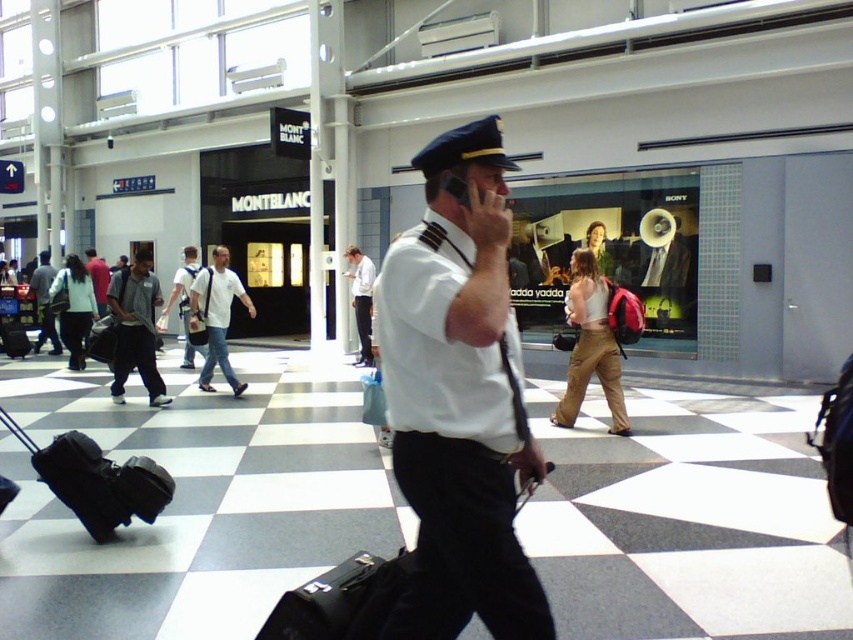
Between white uniform at center and matte white uniform at center, which one has more height?

matte white uniform at center is taller.

From the picture: Who is positioned more to the left, white uniform at center or matte white uniform at center?

From the viewer's perspective, matte white uniform at center appears more on the left side.

This screenshot has height=640, width=853. Describe the element at coordinates (459, 397) in the screenshot. I see `white uniform at center` at that location.

Where is `white uniform at center`? This screenshot has width=853, height=640. white uniform at center is located at coordinates (459, 397).

Looking at this image, between white shirt at center and white fabric shirt at center, which one is positioned lower?

white shirt at center is lower down.

Does white shirt at center come in front of white fabric shirt at center?

No.

At what (x,y) coordinates should I click in order to perform the action: click on white shirt at center. Please return your answer as a coordinate pair (x, y). Looking at the image, I should click on (361, 300).

Find the location of a particular element. The width and height of the screenshot is (853, 640). white shirt at center is located at coordinates 361,300.

Is point (76, 260) closer to camera compared to point (102, 300)?

Yes, it is.

The width and height of the screenshot is (853, 640). Find the location of `matte white uniform at center`. matte white uniform at center is located at coordinates (74, 308).

Locate an element on the screen. This screenshot has height=640, width=853. matte white uniform at center is located at coordinates (74, 308).